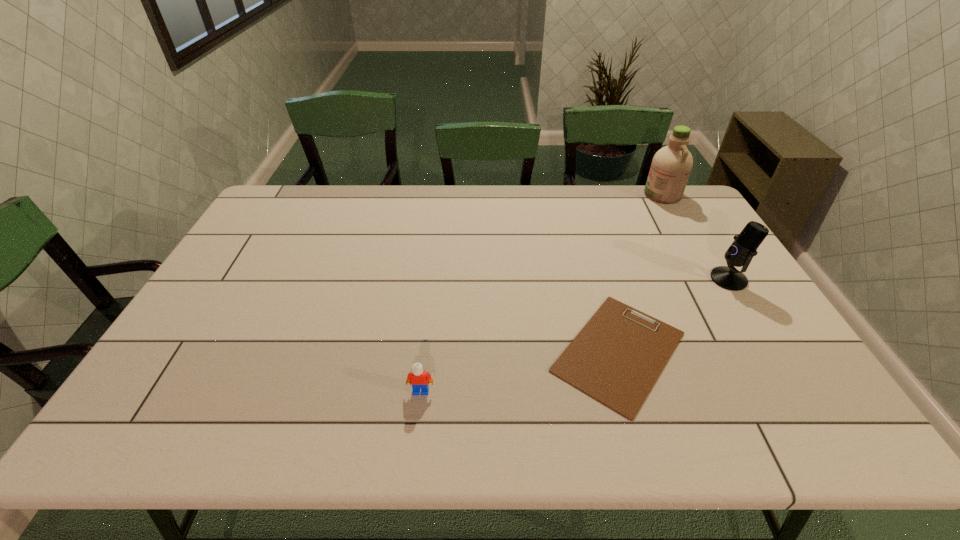
The image size is (960, 540). Find the location of `free space that is in between the Lego and the cleansing agent`. free space that is in between the Lego and the cleansing agent is located at coordinates (541, 293).

Where is `vacant space that is in between the shortest object and the second tallest object`? vacant space that is in between the shortest object and the second tallest object is located at coordinates (674, 315).

The width and height of the screenshot is (960, 540). I want to click on unoccupied area between the cleansing agent and the second object from left to right, so 640,273.

Where is `vacant space that is in between the microphone and the second object from left to right`? Image resolution: width=960 pixels, height=540 pixels. vacant space that is in between the microphone and the second object from left to right is located at coordinates (674, 315).

Find the location of a particular element. This screenshot has height=540, width=960. blank region between the tallest object and the Lego is located at coordinates (541, 293).

This screenshot has width=960, height=540. I want to click on empty space between the third object from right to left and the Lego, so click(x=520, y=372).

The width and height of the screenshot is (960, 540). I want to click on object that is the third closest to the leftmost object, so click(671, 165).

Select which object appears as the second closest to the third nearest object. Please provide its 2D coordinates. Your answer should be formatted as a tuple, i.e. [(x, y)], where the tuple contains the x and y coordinates of a point satisfying the conditions above.

[(671, 165)]

This screenshot has width=960, height=540. In order to click on vacant space that satisfies the following two spatial constraints: 1. on the front label of the tallest object; 2. on the face of the leftmost object in this screenshot , I will do `click(777, 391)`.